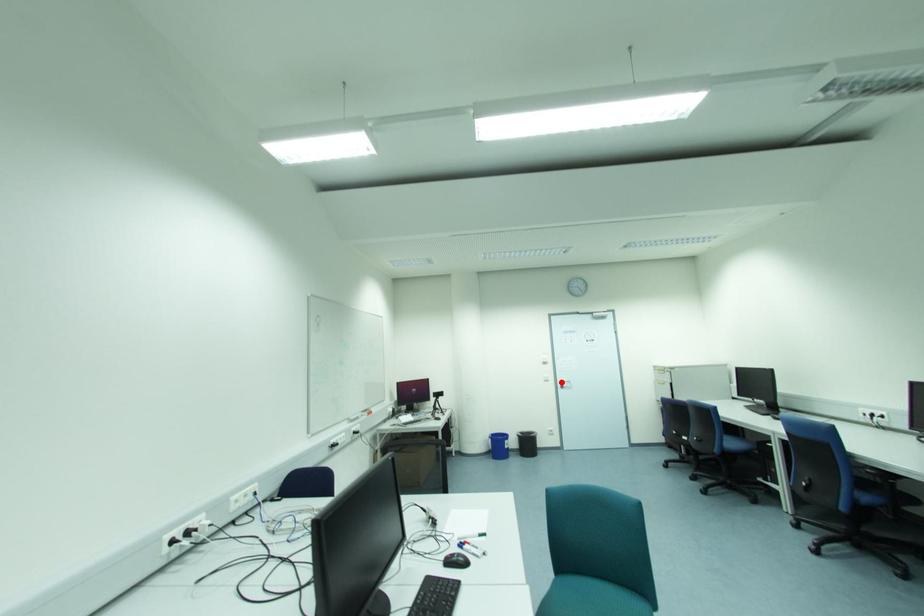
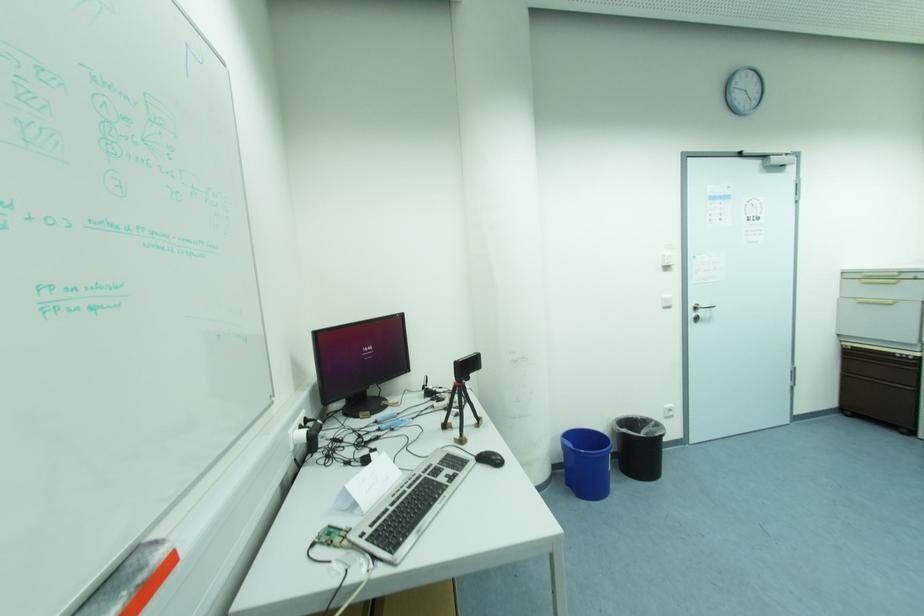
In the second image, find the point that corresponds to the highlighted location in the first image.

(697, 309)